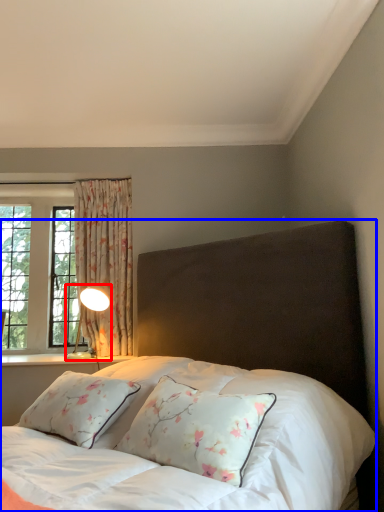
Question: Which point is closer to the camera, table lamp (highlighted by a red box) or bed (highlighted by a blue box)?

Choices:
 (A) table lamp
 (B) bed

Answer: (B)